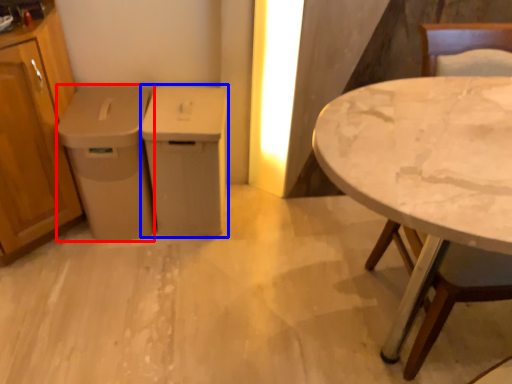
Question: Among these objects, which one is nearest to the camera, cabinetry (highlighted by a red box) or cabinetry (highlighted by a blue box)?

Choices:
 (A) cabinetry
 (B) cabinetry

Answer: (A)